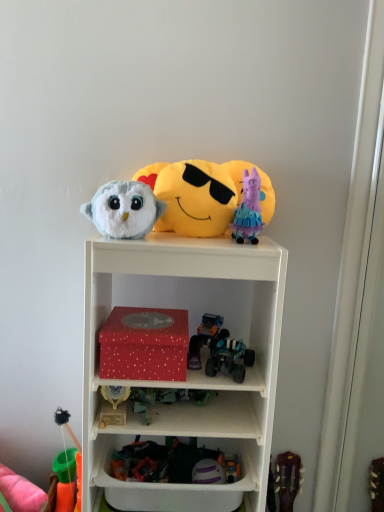
Question: From a real-world perspective, is yellow plush at upper center, the 2th toy viewed from the top, positioned over purple fabric pig at upper center, the first toy when ordered from top to bottom, based on gravity?

Choices:
 (A) no
 (B) yes

Answer: (A)

Question: Is yellow plush at upper center, the 2th toy viewed from the top, to the right of purple fabric pig at upper center, which is counted as the 9th toy, starting from the bottom, from the viewer's perspective?

Choices:
 (A) yes
 (B) no

Answer: (B)

Question: Can you confirm if yellow plush at upper center, the eighth toy positioned from the bottom, is smaller than purple fabric pig at upper center, the first toy when ordered from top to bottom?

Choices:
 (A) no
 (B) yes

Answer: (A)

Question: Is the depth of yellow plush at upper center, the eighth toy positioned from the bottom, less than that of purple fabric pig at upper center, the first toy when ordered from top to bottom?

Choices:
 (A) no
 (B) yes

Answer: (B)

Question: Considering the relative sizes of yellow plush at upper center, the eighth toy positioned from the bottom, and purple fabric pig at upper center, the first toy when ordered from top to bottom, in the image provided, is yellow plush at upper center, the eighth toy positioned from the bottom, thinner than purple fabric pig at upper center, the first toy when ordered from top to bottom,?

Choices:
 (A) no
 (B) yes

Answer: (B)

Question: From a real-world perspective, relative to orange fabric toy at lower left, the 9th toy in the top-to-bottom sequence, is purple fabric pig at upper center, the first toy when ordered from top to bottom, vertically above or below?

Choices:
 (A) below
 (B) above

Answer: (B)

Question: Considering the positions of purple fabric pig at upper center, the first toy when ordered from top to bottom, and orange fabric toy at lower left, the 1th toy in the bottom-to-top sequence, in the image, is purple fabric pig at upper center, the first toy when ordered from top to bottom, bigger or smaller than orange fabric toy at lower left, the 1th toy in the bottom-to-top sequence,?

Choices:
 (A) big
 (B) small

Answer: (B)

Question: From the image's perspective, is purple fabric pig at upper center, the first toy when ordered from top to bottom, above or below orange fabric toy at lower left, the 1th toy in the bottom-to-top sequence?

Choices:
 (A) below
 (B) above

Answer: (B)

Question: Is purple fabric pig at upper center, the first toy when ordered from top to bottom, taller or shorter than orange fabric toy at lower left, the 9th toy in the top-to-bottom sequence?

Choices:
 (A) tall
 (B) short

Answer: (A)

Question: Is teal plastic toy car at center, which is the fifth toy in top-to-bottom order, to the left or to the right of fluffy white owl at upper center, arranged as the 3th toy when viewed from the top, in the image?

Choices:
 (A) left
 (B) right

Answer: (B)

Question: From the image's perspective, relative to fluffy white owl at upper center, arranged as the 3th toy when viewed from the top, is teal plastic toy car at center, placed as the 5th toy when sorted from bottom to top, above or below?

Choices:
 (A) above
 (B) below

Answer: (B)

Question: Is teal plastic toy car at center, which is the fifth toy in top-to-bottom order, bigger or smaller than fluffy white owl at upper center, the 7th toy ordered from the bottom?

Choices:
 (A) big
 (B) small

Answer: (B)

Question: From a real-world perspective, is teal plastic toy car at center, which is the fifth toy in top-to-bottom order, positioned above or below fluffy white owl at upper center, the 7th toy ordered from the bottom?

Choices:
 (A) below
 (B) above

Answer: (A)

Question: Is matte red box at center wider or thinner than teal plastic toy car at center, which is the fifth toy in top-to-bottom order?

Choices:
 (A) thin
 (B) wide

Answer: (B)

Question: In terms of height, does matte red box at center look taller or shorter compared to teal plastic toy car at center, placed as the 5th toy when sorted from bottom to top?

Choices:
 (A) tall
 (B) short

Answer: (A)